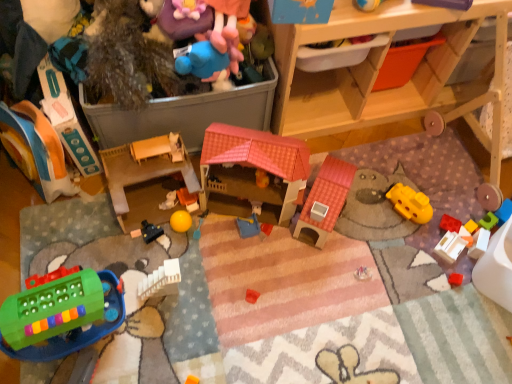
At what (x,y) coordinates should I click in order to perform the action: click on empty space that is in between translucent plastic cube at center, the first toy when ordered from right to left, and green plastic building block at lower left, which is the 3th toy in left-to-right order. Please return your answer as a coordinate pair (x, y). This screenshot has width=512, height=384. Looking at the image, I should click on (279, 277).